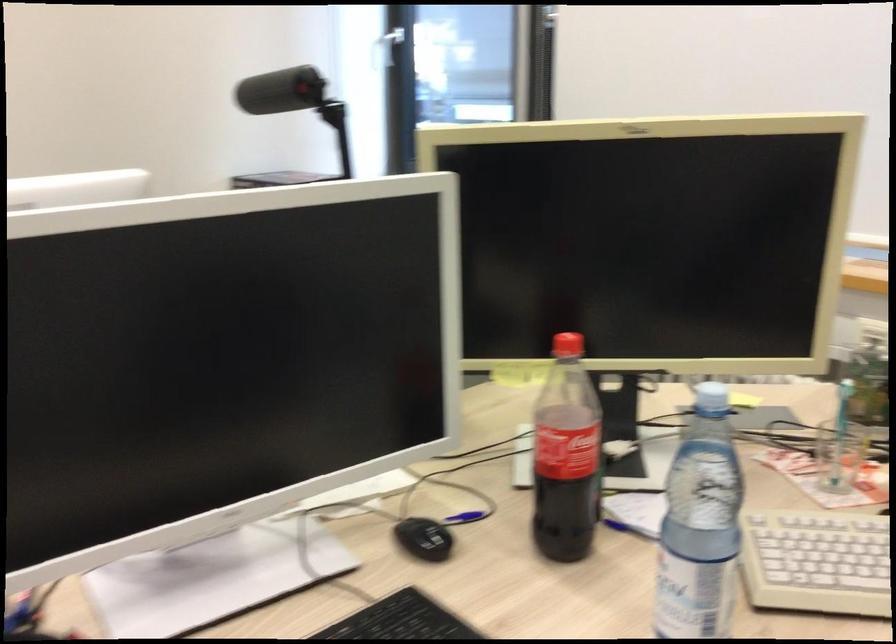
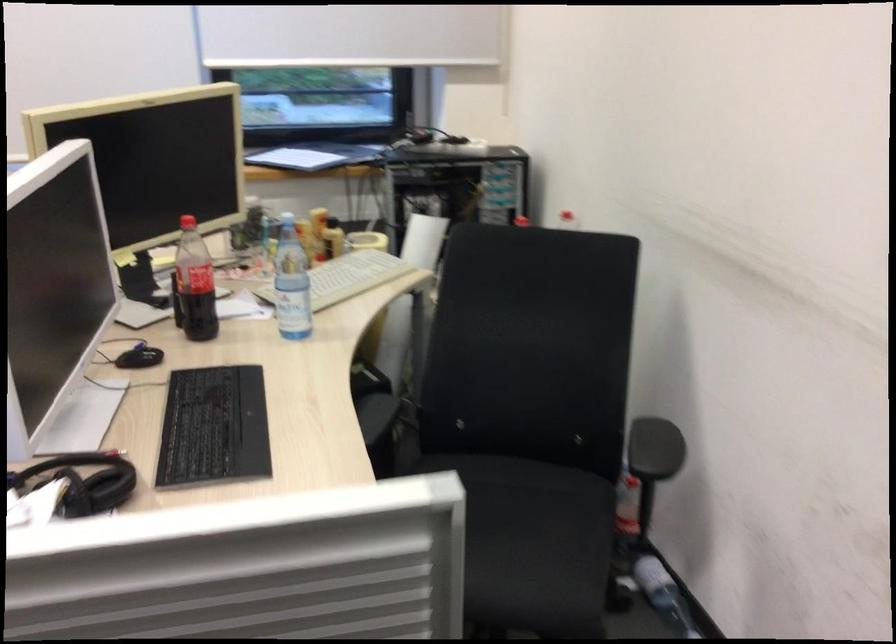
Find the pixel in the second image that matches (437,532) in the first image.

(140, 357)